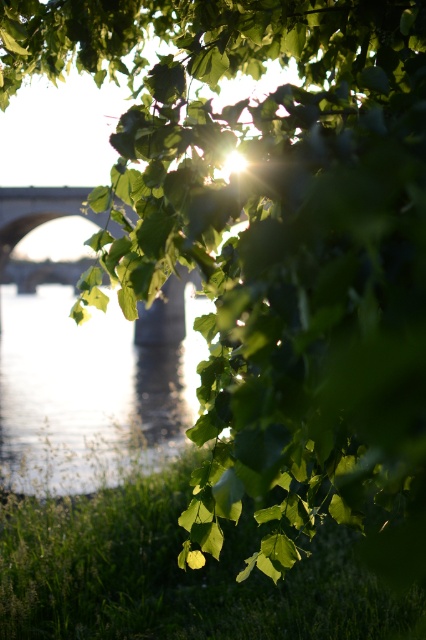
Looking at this image, can you confirm if green leafy grass at lower left is positioned to the right of clear water at center?

Indeed, green leafy grass at lower left is positioned on the right side of clear water at center.

Is point (2, 560) positioned in front of point (158, 356)?

Yes, it is.

Identify the location of green leafy grass at lower left. The image size is (426, 640). (178, 573).